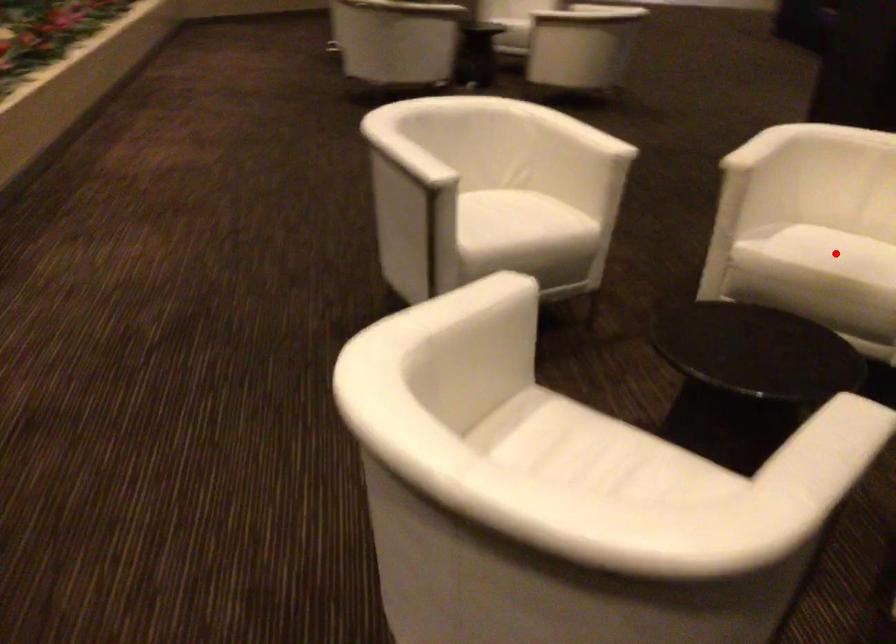
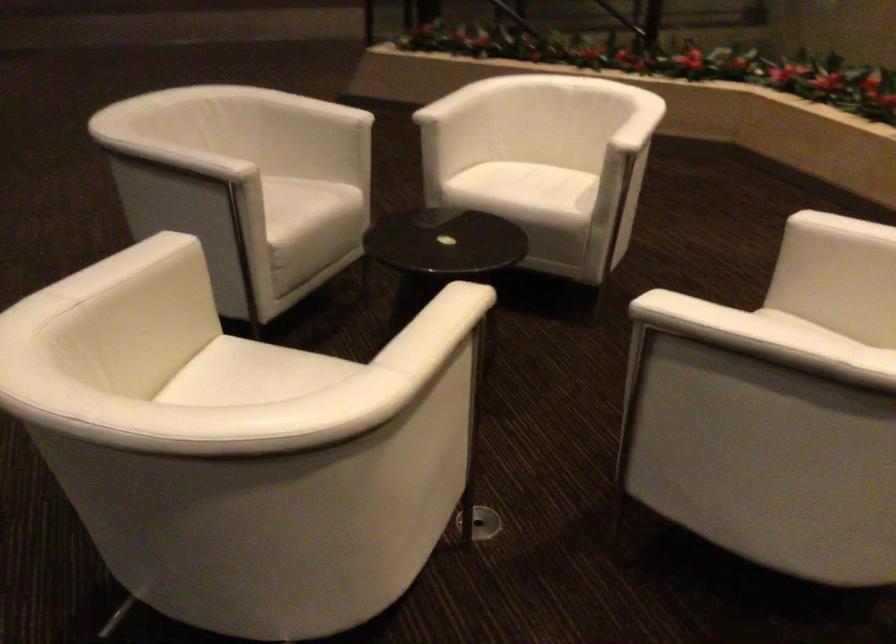
Question: I am providing you with two images of the same scene from different viewpoints. A red point is marked on the first image. At the location where the point appears in image 1, is it still visible in image 2?

Choices:
 (A) Yes
 (B) No

Answer: (B)